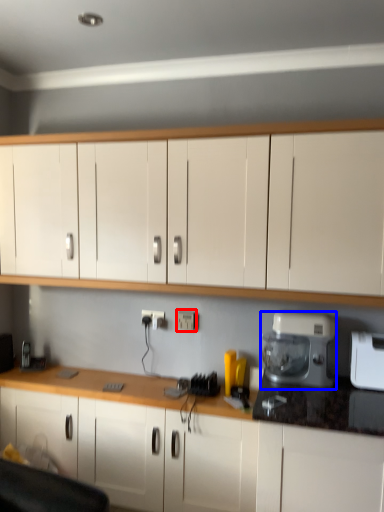
Question: Which object appears farthest to the camera in this image, electric outlet (highlighted by a red box) or home appliance (highlighted by a blue box)?

Choices:
 (A) electric outlet
 (B) home appliance

Answer: (A)